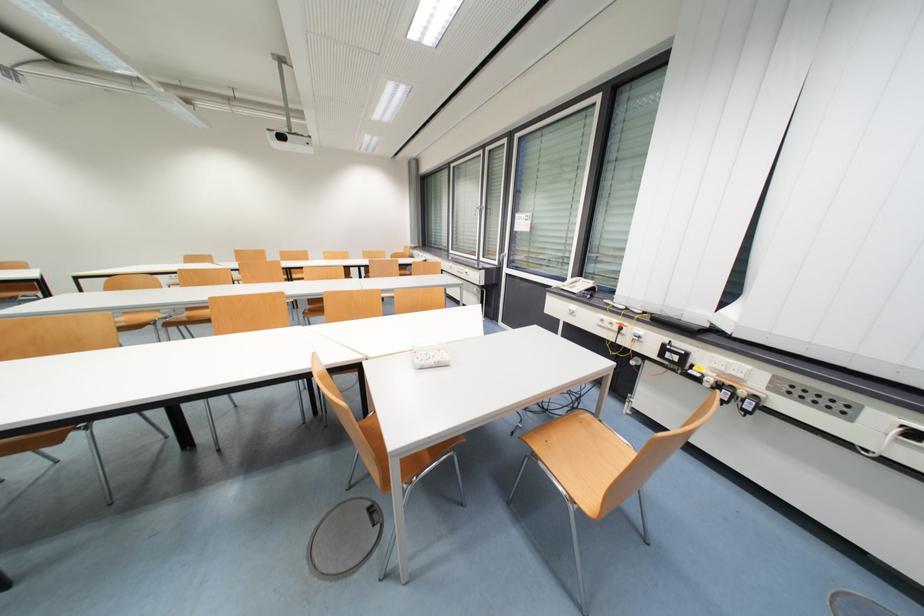
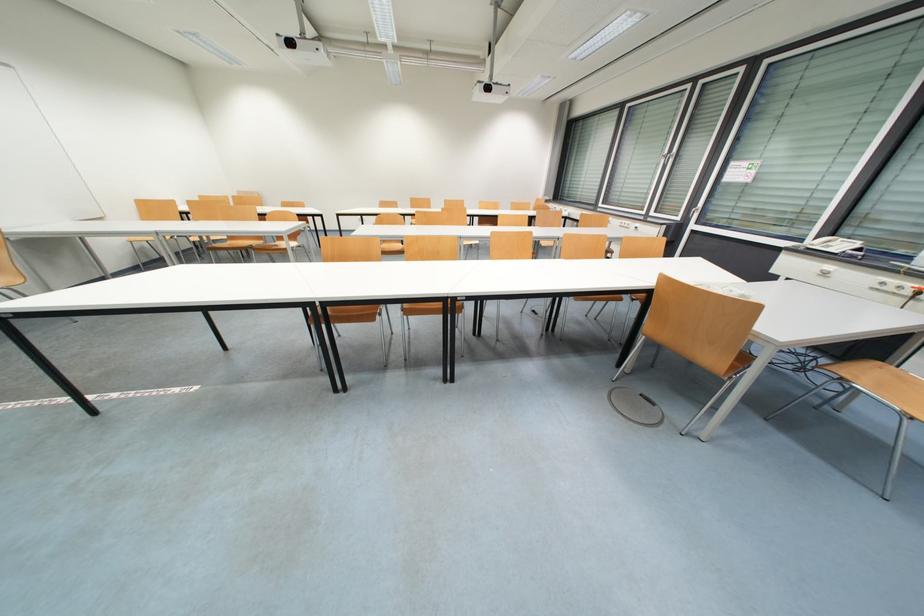
In a continuous first-person perspective shot, in which direction is the camera moving?

The movement direction of the cameraman is left, backward.